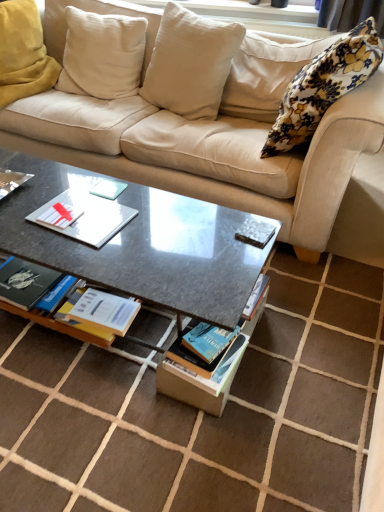
The image size is (384, 512). What are the coordinates of `free point above granite gray coffee table at center (from a real-world perspective)` in the screenshot? It's located at (103, 219).